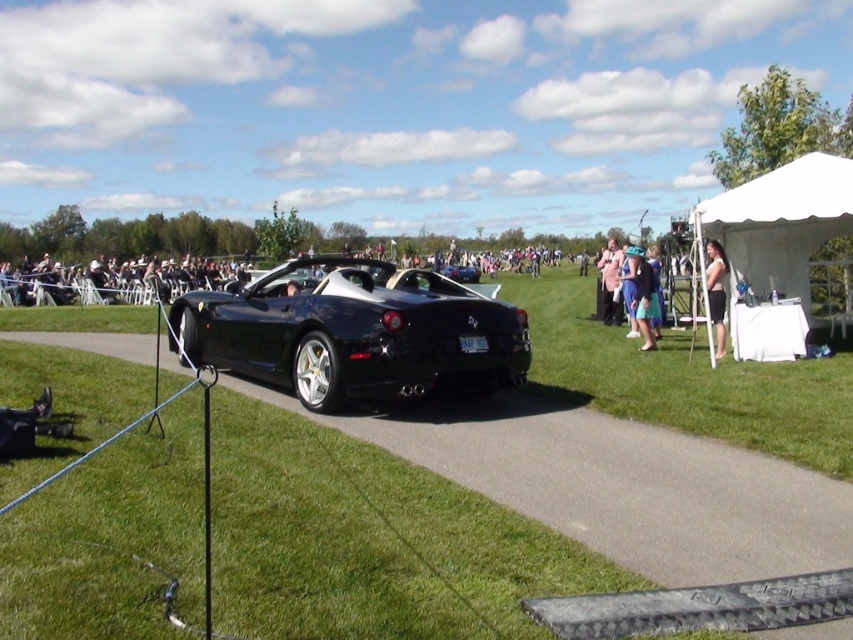
Between shiny black convertible at center and blue fabric dress at center, which one appears on the left side from the viewer's perspective?

From the viewer's perspective, shiny black convertible at center appears more on the left side.

Is point (206, 301) positioned after point (654, 308)?

No, (206, 301) is in front of (654, 308).

Image resolution: width=853 pixels, height=640 pixels. I want to click on shiny black convertible at center, so click(x=352, y=332).

Which is more to the right, shiny black convertible at center or white fabric tent at center right?

white fabric tent at center right

Image resolution: width=853 pixels, height=640 pixels. Describe the element at coordinates (352, 332) in the screenshot. I see `shiny black convertible at center` at that location.

This screenshot has height=640, width=853. In order to click on shiny black convertible at center in this screenshot , I will do `click(352, 332)`.

Between point (726, 397) and point (635, 332), which one is positioned in front?

Point (726, 397) is in front.

Is green grass at center behind blue fabric dress at center?

No, green grass at center is closer to the viewer.

Where is `green grass at center`? green grass at center is located at coordinates (646, 444).